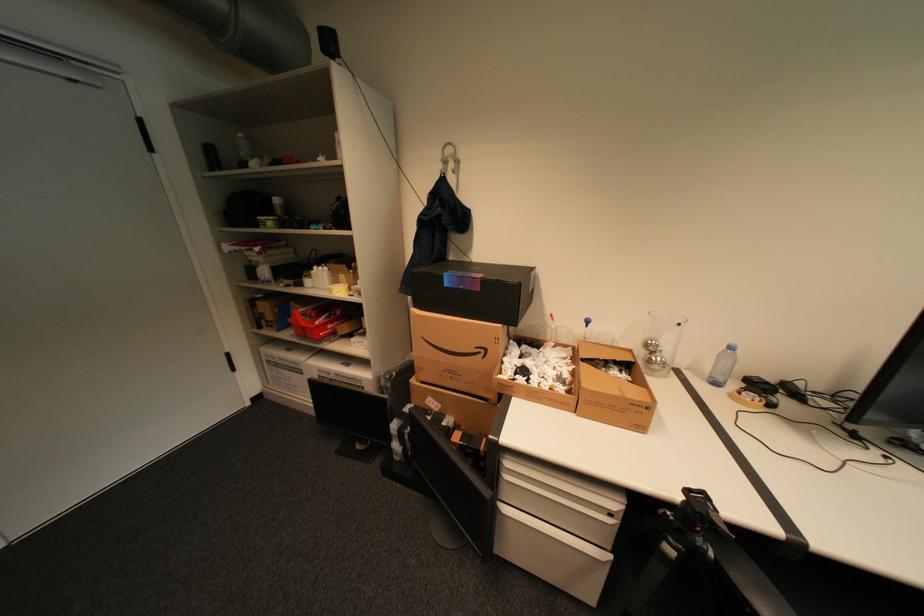
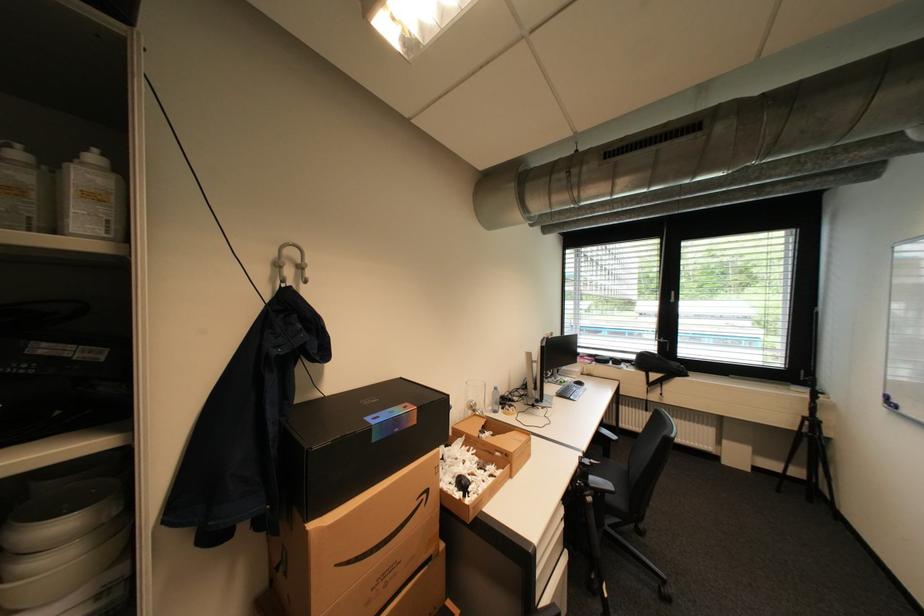
The point at (469, 286) is marked in the first image. Where is the corresponding point in the second image?

(405, 431)